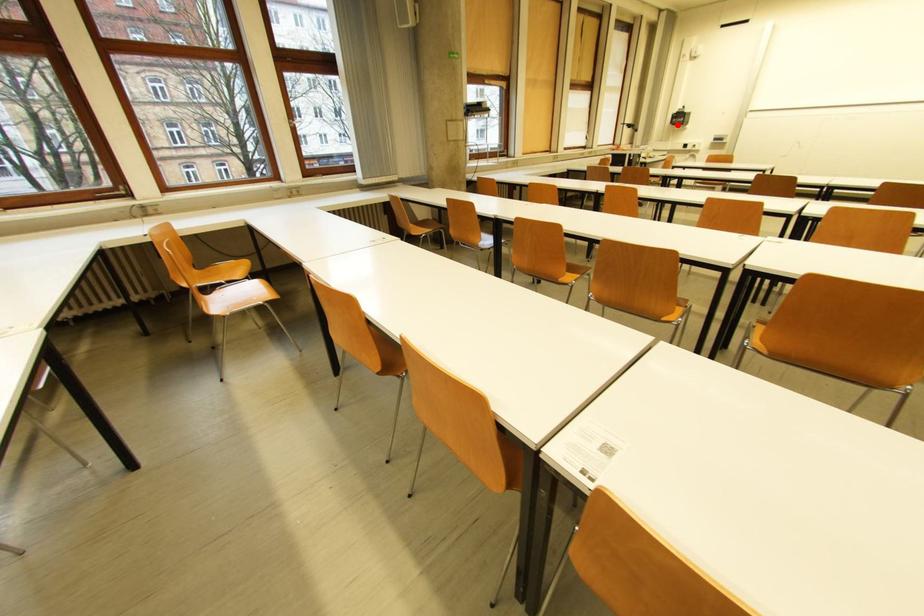
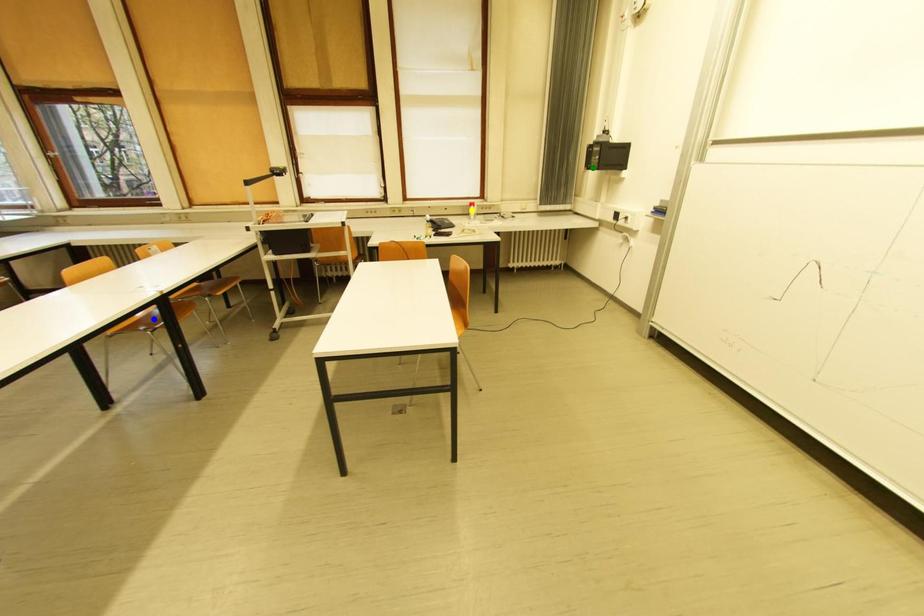
Question: I am providing you with two images of the same scene from different viewpoints. A red point is marked on the first image. You are given multiple points on the second image. Can you choose the point in image 2 that corresponds to the point in image 1?

Choices:
 (A) yellow point
 (B) blue point
 (C) green point

Answer: (C)